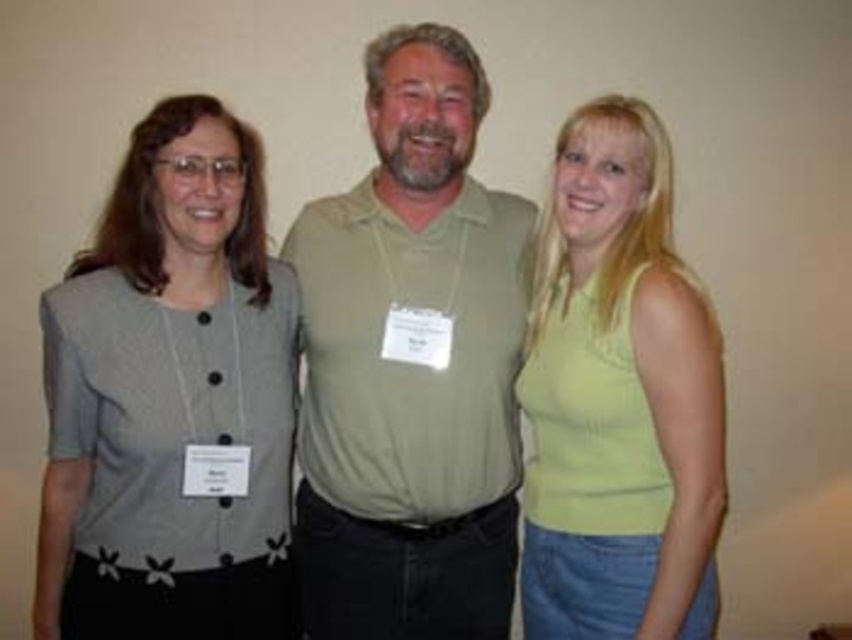
You are taking a photo of two points in the image. The first point is labeled as point [239,406] and the second is point [649,496]. Which point would appear larger in the photo?

Point [239,406] is closer to the camera than point [649,496], so it would appear larger in the photo.

You are a photographer who wants to place a small sticker at the coordinates point (168, 397) on the image. Which object from the following list is this point located on? The options are the gray cardigan over a white blouse at left, the light olive green polo shirt at center, or the sleeveless light green top at right.

The point (168, 397) is located on the gray fabric blouse at left.